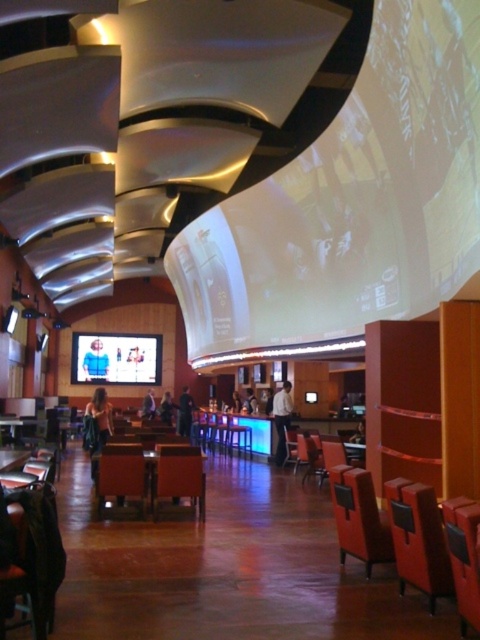
You are standing in the bar and want to move from the point closer to you to the point further away. Which path should you take? The points are labeled as point 1 at (75, 376) and point 2 at (6, 468). Please describe the direction you need to move in terms of the bar layout described in the scene.

The point closer to you is point 2 at (6, 468), and the point further away is point 1 at (75, 376). To move from the closer point to the further one, you should move towards the bar counter with blue lighting since point 1 is positioned behind point 2 in the scene.

You are a customer looking for a place to sit in the lounge. There is a matte brown armchair at center and a smooth leather jacket at center. Which object is wider?

The matte brown armchair at center is wider than the smooth leather jacket at center.